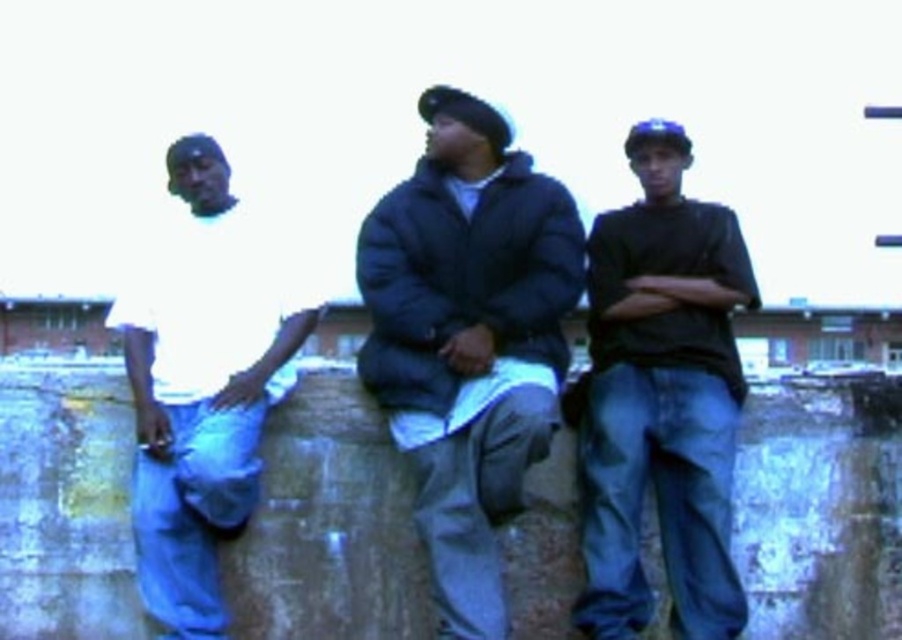
Question: Can you confirm if matte black shirt at center is positioned above white matte shirt at left?

Choices:
 (A) no
 (B) yes

Answer: (B)

Question: Which is farther from the matte black shirt at center?

Choices:
 (A) white matte shirt at left
 (B) dark blue puffy jacket at center

Answer: (A)

Question: Which object is positioned farthest from the matte black shirt at center?

Choices:
 (A) white matte shirt at left
 (B) dark blue puffy jacket at center

Answer: (A)

Question: Is dark blue puffy jacket at center further to the viewer compared to matte black shirt at center?

Choices:
 (A) no
 (B) yes

Answer: (A)

Question: Is dark blue puffy jacket at center positioned in front of matte black shirt at center?

Choices:
 (A) yes
 (B) no

Answer: (A)

Question: Among these objects, which one is farthest from the camera?

Choices:
 (A) dark blue puffy jacket at center
 (B) white matte shirt at left
 (C) matte black shirt at center

Answer: (C)